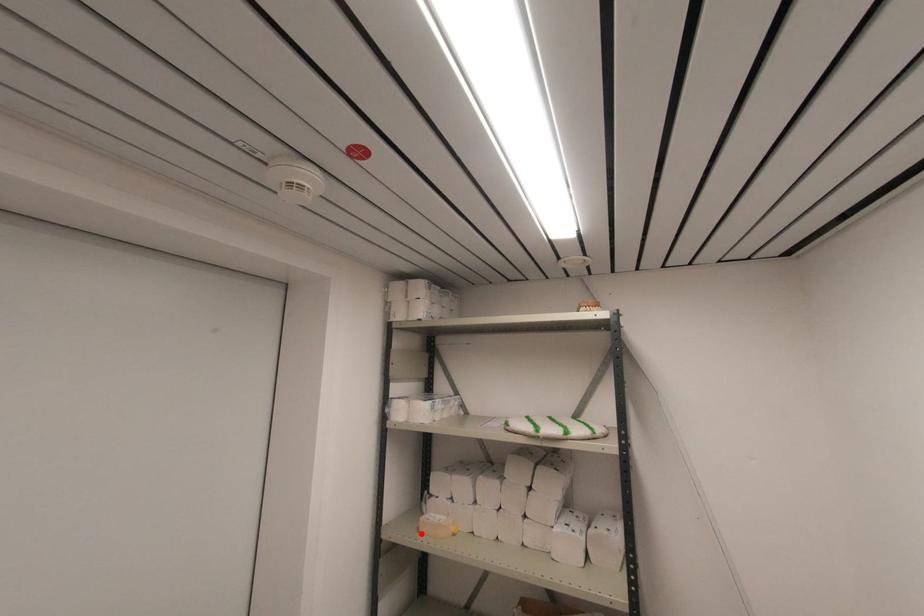
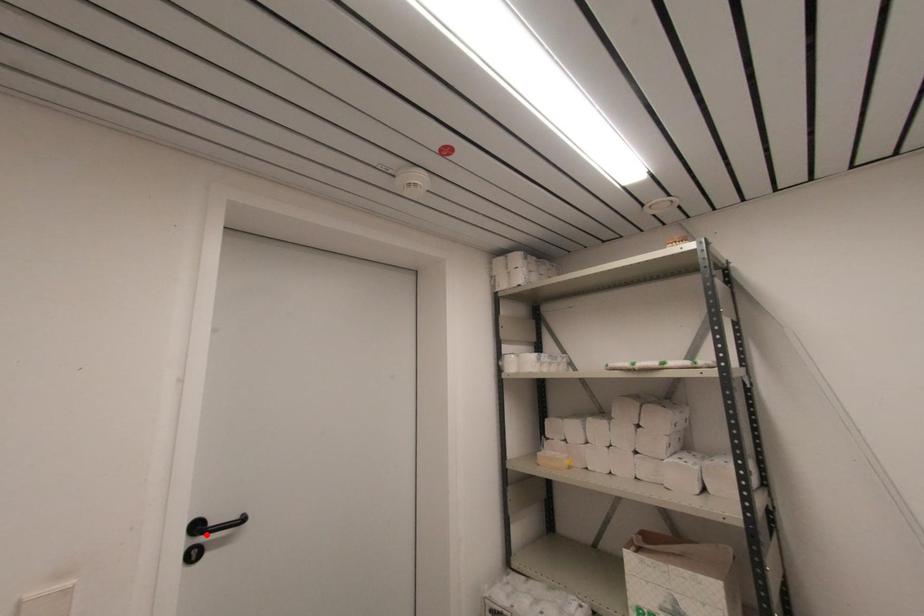
I am providing you with two images of the same scene from different viewpoints. A red point is marked on the first image and another point is marked on the second image. Does the point marked in image1 correspond to the same location as the one in image2?

No